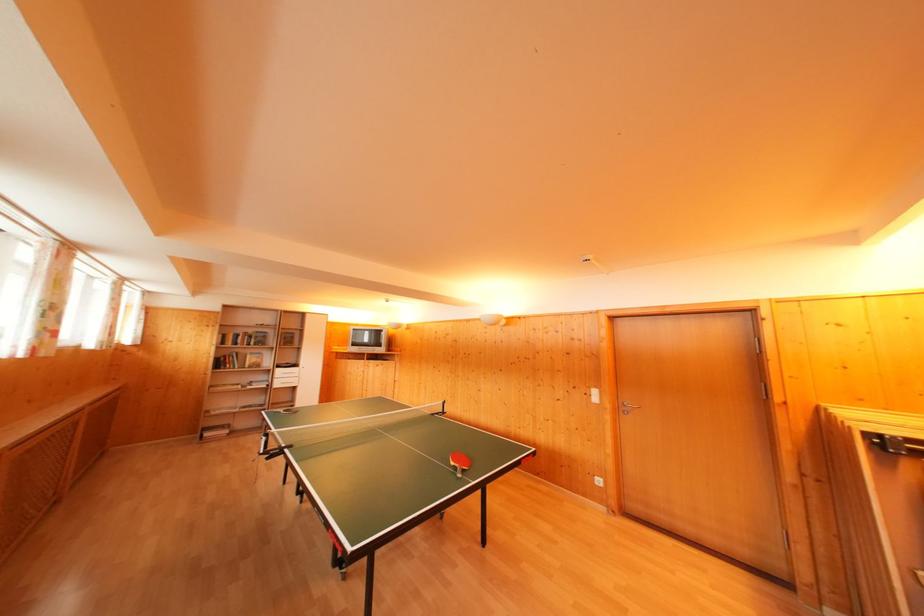
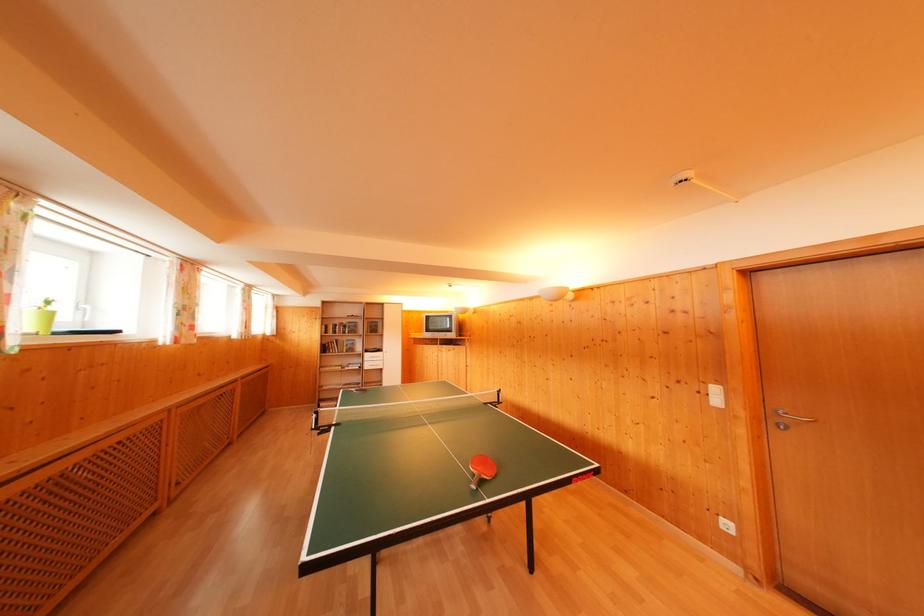
Find the pixel in the second image that matches point 600,398 in the first image.

(721, 395)